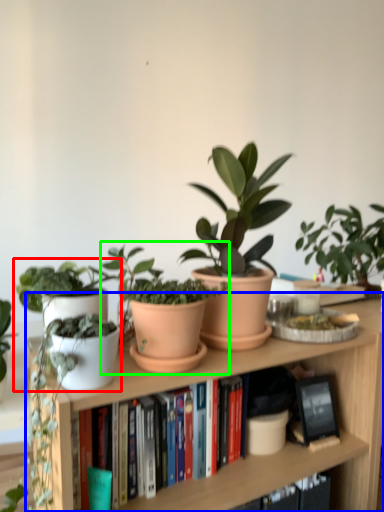
Question: Which object is positioned closest to houseplant (highlighted by a red box)? Select from bookcase (highlighted by a blue box) and houseplant (highlighted by a green box).

Choices:
 (A) bookcase
 (B) houseplant

Answer: (B)